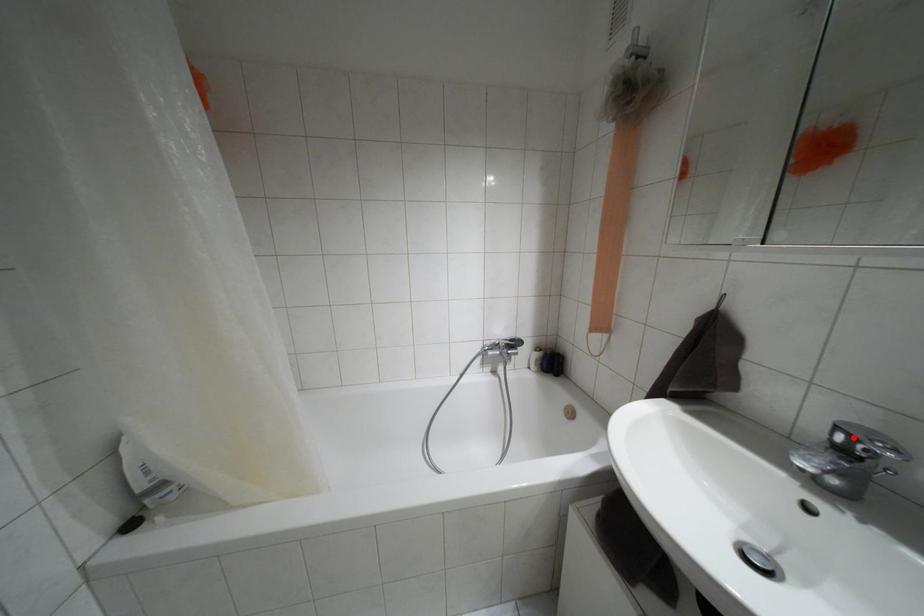
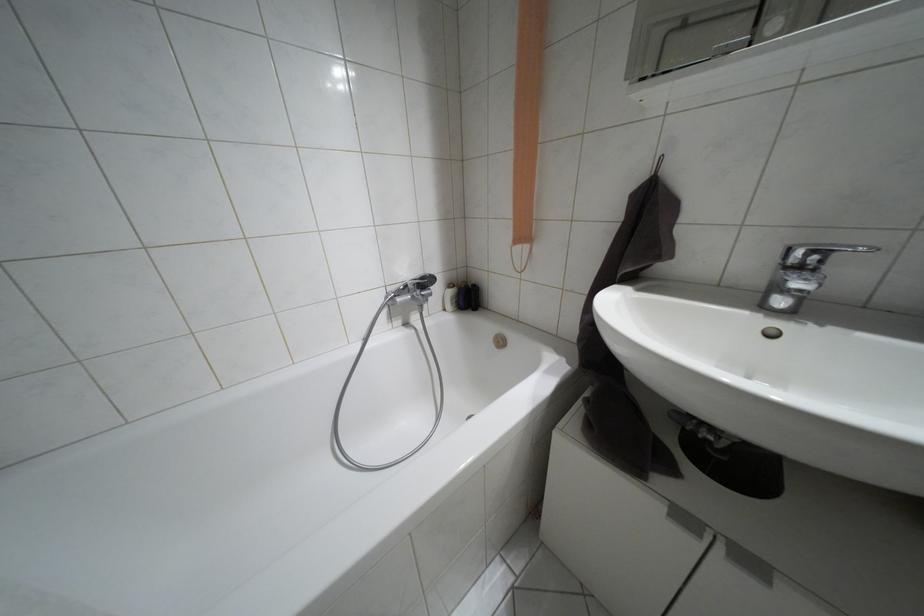
Where in the second image is the point corresponding to the highlighted location from the first image?

(810, 253)